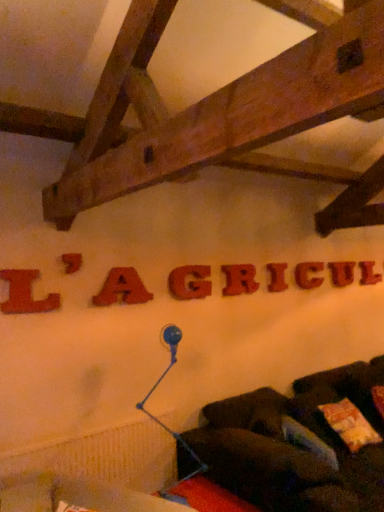
Question: Is blue glass lamp at lower center to the right of rubberized red letter r at center, arranged as the 5th letter when viewed from the right, from the viewer's perspective?

Choices:
 (A) no
 (B) yes

Answer: (A)

Question: Does blue glass lamp at lower center have a lesser height compared to rubberized red letter r at center, placed as the fifth letter when sorted from front to back?

Choices:
 (A) yes
 (B) no

Answer: (B)

Question: Considering the relative sizes of blue glass lamp at lower center and rubberized red letter r at center, placed as the 5th letter when sorted from left to right, in the image provided, is blue glass lamp at lower center wider than rubberized red letter r at center, placed as the 5th letter when sorted from left to right,?

Choices:
 (A) yes
 (B) no

Answer: (A)

Question: Is blue glass lamp at lower center positioned with its back to rubberized red letter r at center, which ranks as the 5th letter in back-to-front order?

Choices:
 (A) yes
 (B) no

Answer: (B)

Question: Is blue glass lamp at lower center at the left side of rubberized red letter r at center, arranged as the 5th letter when viewed from the right?

Choices:
 (A) yes
 (B) no

Answer: (A)

Question: In terms of width, does dark brown fabric couch at lower right look wider or thinner when compared to matte red sign at center, placed as the 1th letter when sorted from back to front?

Choices:
 (A) thin
 (B) wide

Answer: (B)

Question: In terms of size, does dark brown fabric couch at lower right appear bigger or smaller than matte red sign at center, placed as the 1th letter when sorted from back to front?

Choices:
 (A) big
 (B) small

Answer: (A)

Question: From a real-world perspective, is dark brown fabric couch at lower right physically located above or below matte red sign at center, which ranks as the ninth letter in left-to-right order?

Choices:
 (A) below
 (B) above

Answer: (A)

Question: Would you say dark brown fabric couch at lower right is inside or outside matte red sign at center, placed as the 1th letter when sorted from back to front?

Choices:
 (A) inside
 (B) outside

Answer: (B)

Question: Looking at their shapes, would you say matte red letter at upper center, acting as the eighth letter starting from the back, is wider or thinner than blue glass lamp at lower center?

Choices:
 (A) thin
 (B) wide

Answer: (A)

Question: In the image, is matte red letter at upper center, which is counted as the 2th letter, starting from the left, positioned in front of or behind blue glass lamp at lower center?

Choices:
 (A) front
 (B) behind

Answer: (B)

Question: From a real-world perspective, relative to blue glass lamp at lower center, is matte red letter at upper center, which is counted as the 2th letter, starting from the left, vertically above or below?

Choices:
 (A) below
 (B) above

Answer: (B)

Question: From the image's perspective, is matte red letter at upper center, acting as the eighth letter starting from the back, positioned above or below blue glass lamp at lower center?

Choices:
 (A) above
 (B) below

Answer: (A)

Question: Considering the positions of matte red letter at center, which is the sixth letter from left to right, and matte red letter at upper center, the 8th letter viewed from the right, in the image, is matte red letter at center, which is the sixth letter from left to right, bigger or smaller than matte red letter at upper center, the 8th letter viewed from the right,?

Choices:
 (A) big
 (B) small

Answer: (A)

Question: Is point (283, 264) closer or farther from the camera than point (79, 265)?

Choices:
 (A) closer
 (B) farther

Answer: (B)